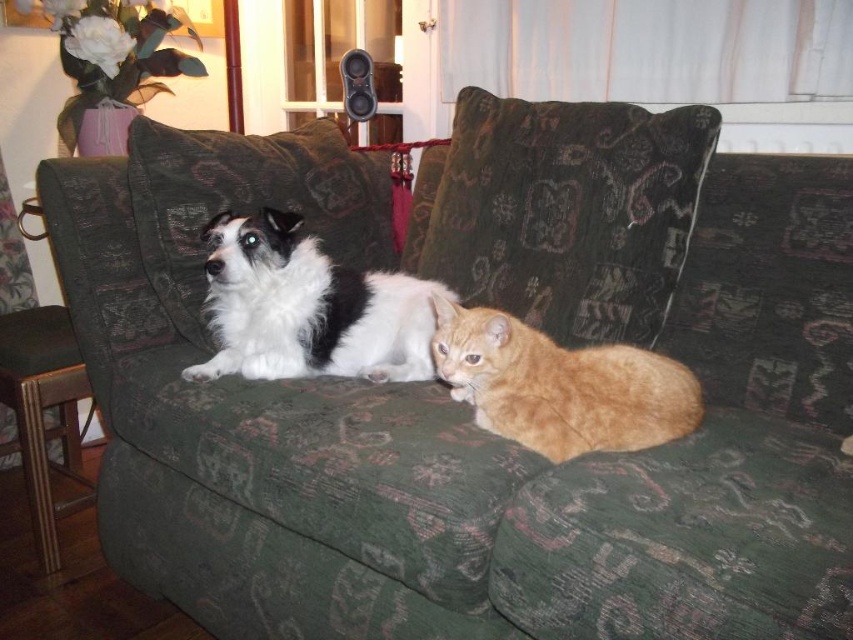
Question: Is white fluffy dog at center behind orange fur cat at center?

Choices:
 (A) no
 (B) yes

Answer: (B)

Question: Which point appears farthest from the camera in this image?

Choices:
 (A) (347, 61)
 (B) (422, 300)

Answer: (A)

Question: Estimate the real-world distances between objects in this image. Which object is farther from the black plastic speaker at upper center?

Choices:
 (A) white fluffy dog at center
 (B) orange fur cat at center

Answer: (B)

Question: Does white fluffy dog at center appear over black plastic speaker at upper center?

Choices:
 (A) no
 (B) yes

Answer: (A)

Question: In this image, where is white fluffy dog at center located relative to black plastic speaker at upper center?

Choices:
 (A) left
 (B) right

Answer: (A)

Question: Which of these objects is positioned farthest from the white fluffy dog at center?

Choices:
 (A) black plastic speaker at upper center
 (B) orange fur cat at center

Answer: (A)